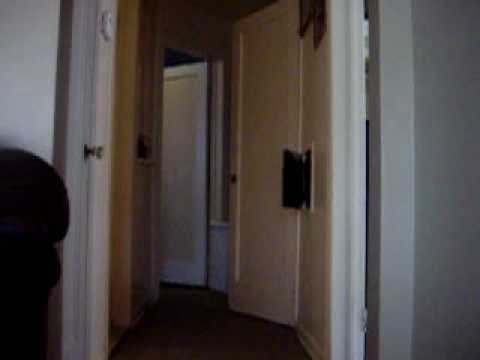
Identify the location of doorknob. This screenshot has width=480, height=360. (233, 180).